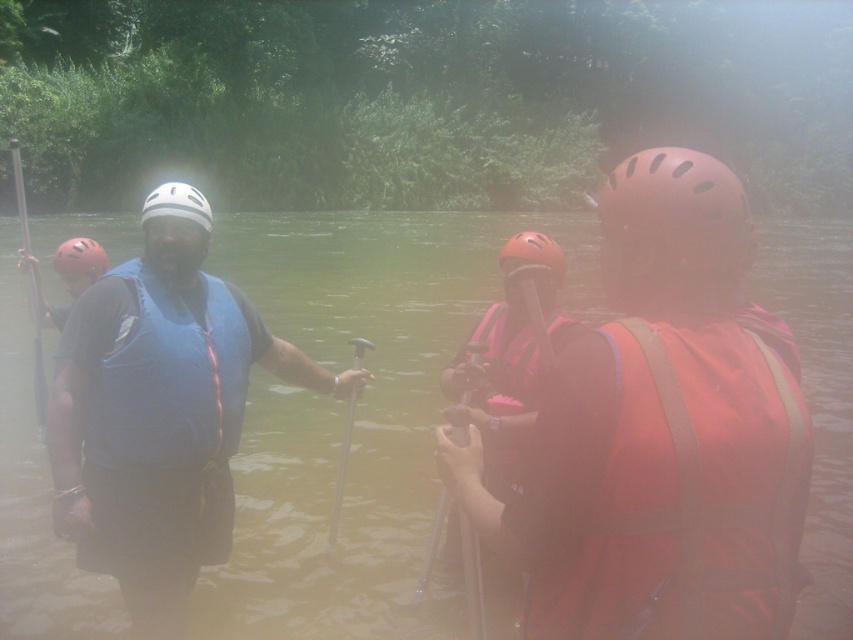
You are a safety inspector checking the gear of rafters. You notice the matte pink life vest at center and the metallic silver paddle at center. Which item is shorter in height?

The matte pink life vest at center is shorter in height compared to the metallic silver paddle at center.

You are a safety inspector reviewing the rafting scene. The rafting company requires all life vests to be placed at the center of the raft for safety. Is the matte pink life vest at center positioned correctly according to the company policy?

The matte pink life vest at center is positioned at point (x=509, y=355), which is the center of the raft, so it is correctly placed according to the company policy.